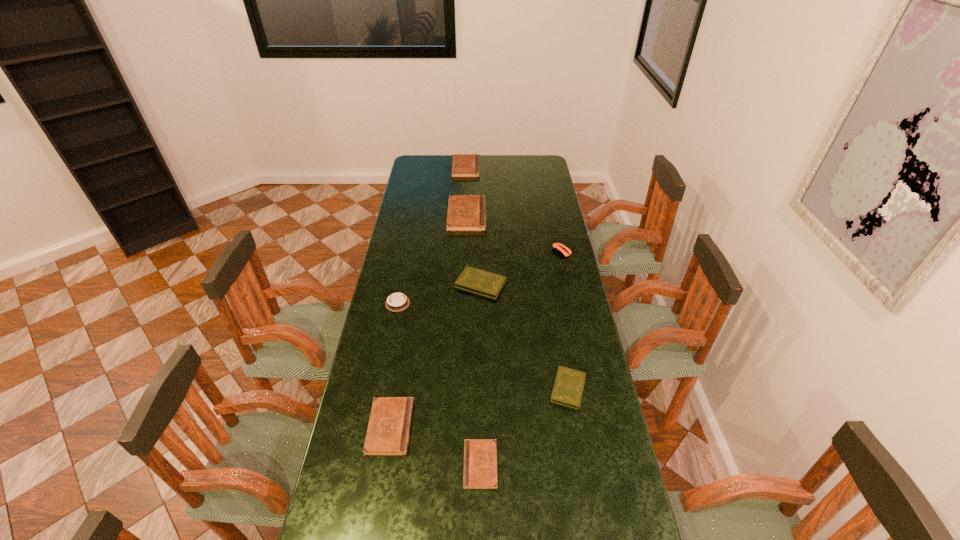
Identify the location of the fifth nearest diary. Image resolution: width=960 pixels, height=540 pixels. (466, 213).

This screenshot has height=540, width=960. Identify the location of the third nearest brown diary. click(466, 213).

You are a GUI agent. You are given a task and a screenshot of the screen. Output one action in this format:
    pyautogui.click(x=<x>, y=<y>)
    Task: Click on the farthest brown diary
    
    Given the screenshot: What is the action you would take?
    pyautogui.click(x=464, y=165)

This screenshot has width=960, height=540. In order to click on the farthest object in this screenshot , I will do `click(464, 165)`.

This screenshot has height=540, width=960. I want to click on computer mouse, so pos(559,248).

Find the location of a particular element. The height and width of the screenshot is (540, 960). the third farthest object is located at coordinates (559, 248).

This screenshot has height=540, width=960. What are the coordinates of `chocolate cake` in the screenshot? It's located at (398, 301).

Locate an element on the screen. the third farthest diary is located at coordinates (474, 280).

I want to click on the bigger green diary, so pyautogui.click(x=474, y=280).

Find the location of a particular element. The height and width of the screenshot is (540, 960). the third biggest brown diary is located at coordinates (388, 432).